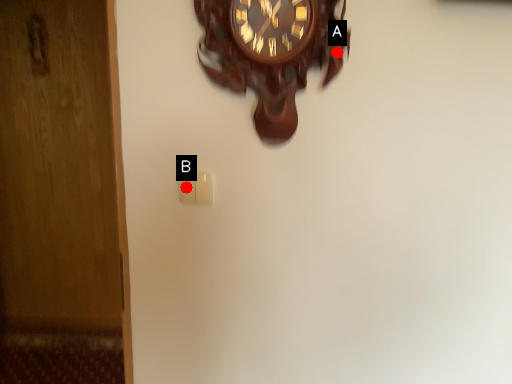
Question: Two points are circled on the image, labeled by A and B beside each circle. Among these points, which one is nearest to the camera?

Choices:
 (A) A is closer
 (B) B is closer

Answer: (A)